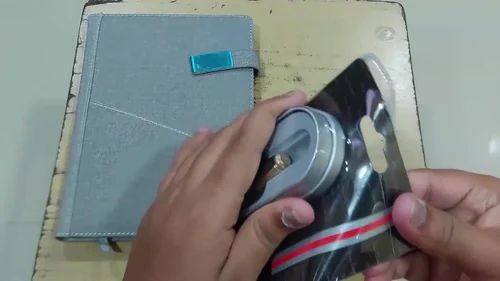
The width and height of the screenshot is (500, 281). I want to click on table, so click(x=468, y=75).